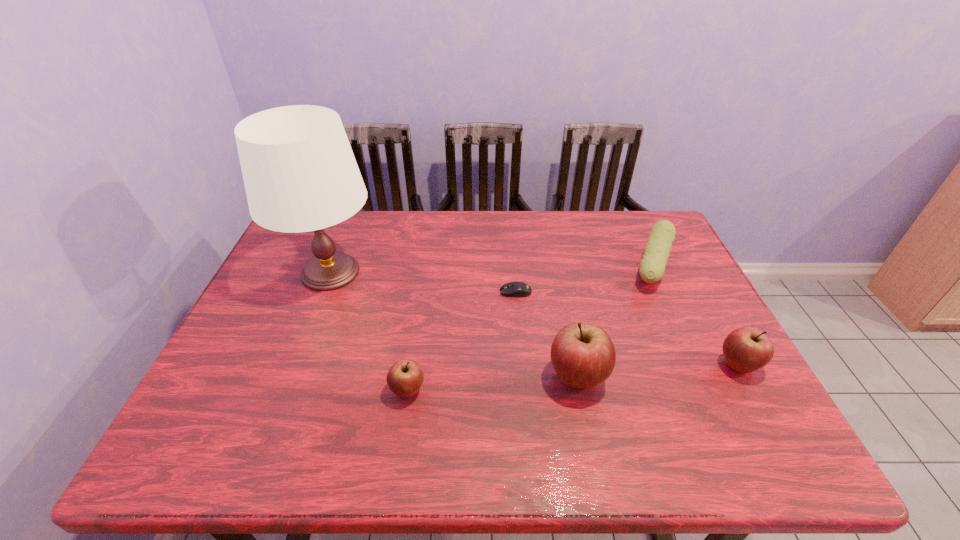
The image size is (960, 540). Find the location of `the leftmost apple`. the leftmost apple is located at coordinates (405, 377).

Locate an element on the screen. the shortest apple is located at coordinates (405, 377).

The width and height of the screenshot is (960, 540). In order to click on the tallest apple in this screenshot , I will do `click(583, 355)`.

Image resolution: width=960 pixels, height=540 pixels. Identify the location of the fifth shortest object. (583, 355).

Identify the location of the rightmost apple. This screenshot has height=540, width=960. (746, 349).

The image size is (960, 540). What are the coordinates of `the second shortest apple` in the screenshot? It's located at (746, 349).

This screenshot has width=960, height=540. Identify the location of the fourth object from right to left. (513, 289).

Identify the location of the shortest object. The width and height of the screenshot is (960, 540). (513, 289).

Where is `the leftmost object`? The height and width of the screenshot is (540, 960). the leftmost object is located at coordinates (300, 174).

Locate an element on the screen. the tallest object is located at coordinates (300, 174).